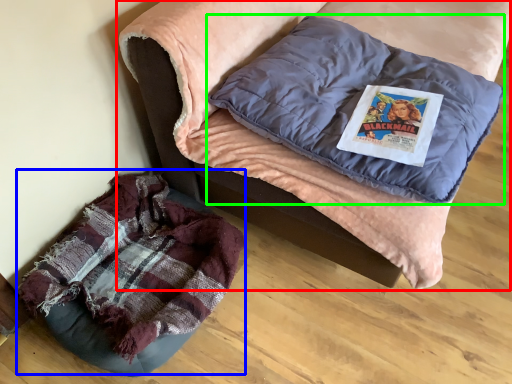
Question: Which object is the closest to the furniture (highlighted by a red box)? Choose among these: bean bag chair (highlighted by a blue box) or pillow (highlighted by a green box).

Choices:
 (A) bean bag chair
 (B) pillow

Answer: (B)